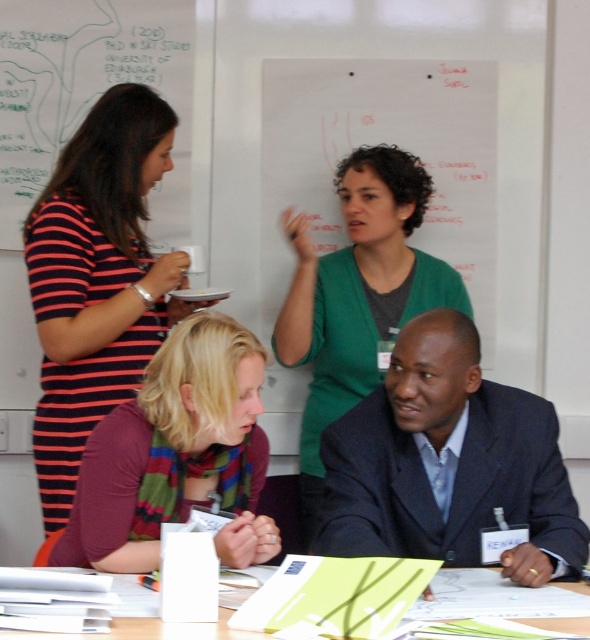
Is striped fabric dress at left thinner than multicolored scarf at center?

Yes.

Who is taller, striped fabric dress at left or multicolored scarf at center?

striped fabric dress at left is taller.

Which is in front, point (165, 310) or point (260, 522)?

Positioned in front is point (260, 522).

This screenshot has height=640, width=590. Find the location of `striped fabric dress at left`. striped fabric dress at left is located at coordinates (96, 280).

In the scene shown: Between green matte sweater at upper center and green paper at lower center, which one has more height?

With more height is green matte sweater at upper center.

Which is in front, point (366, 225) or point (155, 621)?

Point (155, 621) is more forward.

Does point (349, 362) come in front of point (545, 608)?

No, (349, 362) is further to viewer.

Locate an element on the screen. The width and height of the screenshot is (590, 640). green matte sweater at upper center is located at coordinates (358, 294).

Can you confirm if dark blue suit at center is positioned to the right of green matte sweater at upper center?

Correct, you'll find dark blue suit at center to the right of green matte sweater at upper center.

Is point (394, 513) behind point (316, 380)?

No, (394, 513) is closer to viewer.

Describe the element at coordinates (447, 464) in the screenshot. I see `dark blue suit at center` at that location.

At what (x,y) coordinates should I click in order to perform the action: click on dark blue suit at center. Please return your answer as a coordinate pair (x, y). This screenshot has width=590, height=640. Looking at the image, I should click on (447, 464).